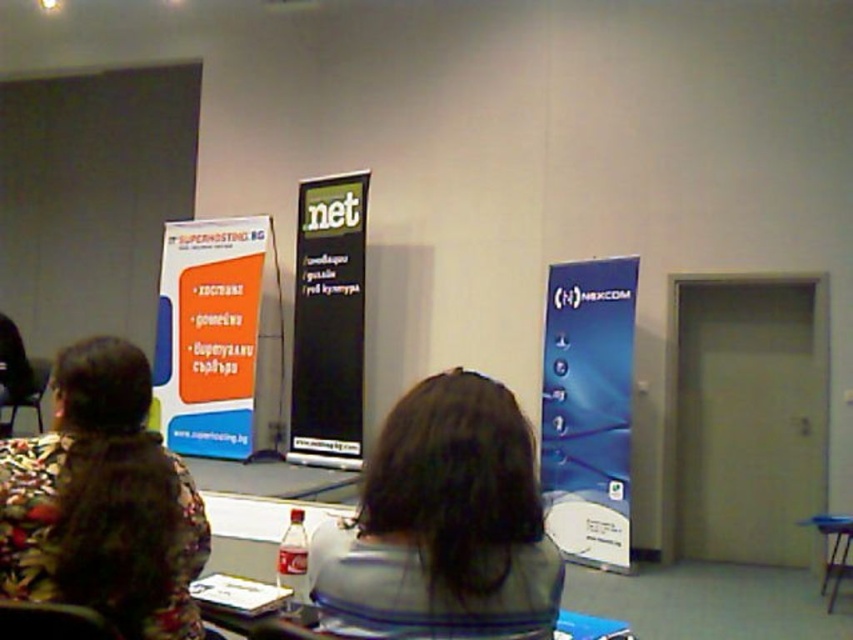
Question: Which of the following is the closest to the observer?

Choices:
 (A) (340, 324)
 (B) (416, 554)
 (C) (39, 416)

Answer: (B)

Question: Is gray fabric shirt at center positioned behind floral fabric jacket at left?

Choices:
 (A) no
 (B) yes

Answer: (A)

Question: Which point is farther to the camera?

Choices:
 (A) (294, 404)
 (B) (33, 394)

Answer: (B)

Question: Which of the following is the closest to the observer?

Choices:
 (A) blue glossy banner at right
 (B) floral fabric jacket at left
 (C) metallic gray chair at left

Answer: (B)

Question: Does floral fabric jacket at left have a smaller size compared to blue glossy banner at right?

Choices:
 (A) no
 (B) yes

Answer: (B)

Question: Does blue glossy banner at right have a greater width compared to black glossy projection screen at center?

Choices:
 (A) no
 (B) yes

Answer: (A)